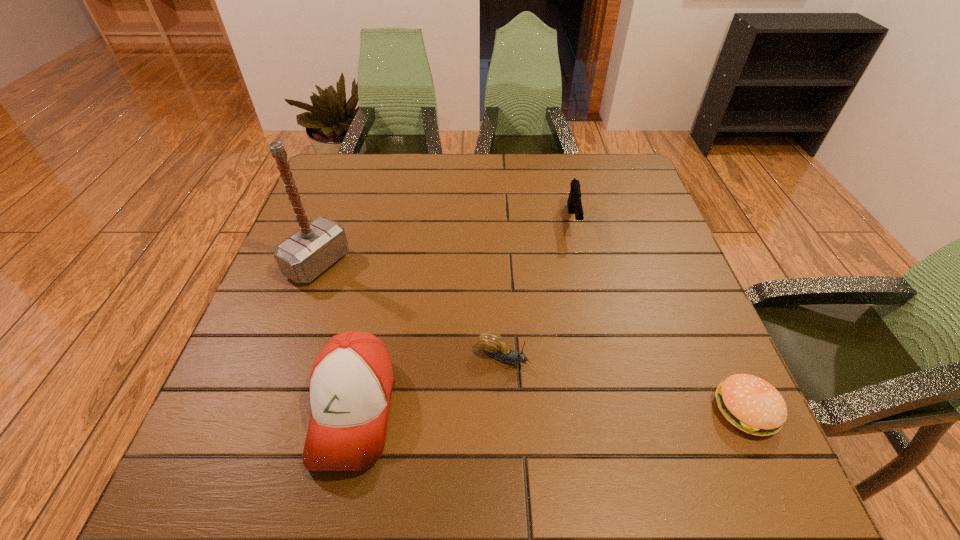
At what (x,y) coordinates should I click in order to perform the action: click on object that is at the left edge. Please return your answer as a coordinate pair (x, y). Looking at the image, I should click on 304,255.

Image resolution: width=960 pixels, height=540 pixels. I want to click on object located in the right edge section of the desktop, so click(751, 404).

Locate an element on the screen. object present at the near right corner is located at coordinates tap(751, 404).

You are a GUI agent. You are given a task and a screenshot of the screen. Output one action in this format:
    pyautogui.click(x=<x>, y=<y>)
    Task: Click on the vacant area at the far edge
    The height and width of the screenshot is (540, 960).
    Given the screenshot: What is the action you would take?
    pyautogui.click(x=485, y=175)

The width and height of the screenshot is (960, 540). I want to click on vacant space at the near edge, so click(484, 397).

At what (x,y) coordinates should I click in order to perform the action: click on vacant space at the right edge. Please return your answer as a coordinate pair (x, y). Looking at the image, I should click on (650, 251).

What are the coordinates of `free region at the far left corner of the desktop` in the screenshot? It's located at (336, 198).

Where is `free space at the far right corner`? This screenshot has height=540, width=960. free space at the far right corner is located at coordinates (615, 161).

The height and width of the screenshot is (540, 960). I want to click on empty location between the escargot and the fourth shortest object, so click(428, 383).

The width and height of the screenshot is (960, 540). I want to click on free space that is in between the escargot and the baseball cap, so click(x=428, y=383).